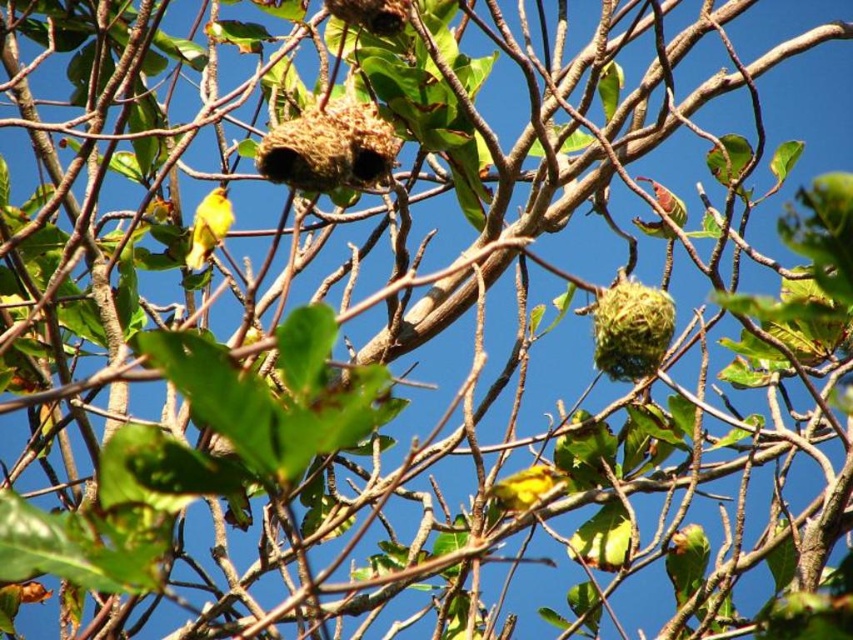
Question: Considering the relative positions of yellow matte bird at left and green matte bird at upper right in the image provided, where is yellow matte bird at left located with respect to green matte bird at upper right?

Choices:
 (A) right
 (B) left

Answer: (B)

Question: Which point appears farthest from the camera in this image?

Choices:
 (A) (677, 211)
 (B) (194, 227)

Answer: (B)

Question: Which object is closer to the camera taking this photo?

Choices:
 (A) yellow matte bird at left
 (B) green matte bird at upper right

Answer: (B)

Question: Which object is farther from the camera taking this photo?

Choices:
 (A) green matte bird at upper right
 (B) yellow matte bird at left

Answer: (B)

Question: Can you confirm if yellow matte bird at left is positioned to the left of green matte bird at upper right?

Choices:
 (A) no
 (B) yes

Answer: (B)

Question: Does yellow matte bird at left have a larger size compared to green matte bird at upper right?

Choices:
 (A) yes
 (B) no

Answer: (A)